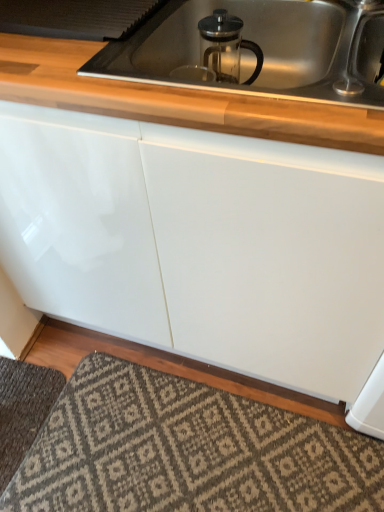
Where is `spots to the right of dark gray textured rug at lower left, which appears as the 1th doormat when viewed from the left`? The image size is (384, 512). spots to the right of dark gray textured rug at lower left, which appears as the 1th doormat when viewed from the left is located at coordinates (82, 414).